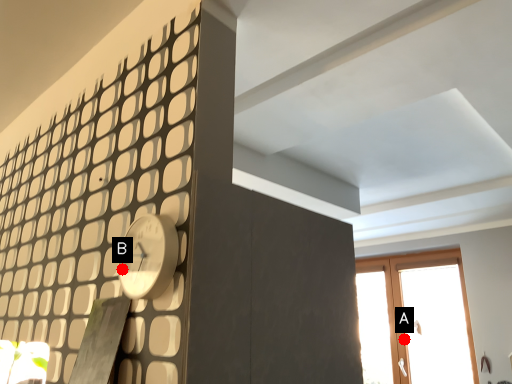
Question: Two points are circled on the image, labeled by A and B beside each circle. Among these points, which one is farthest from the camera?

Choices:
 (A) A is further
 (B) B is further

Answer: (A)